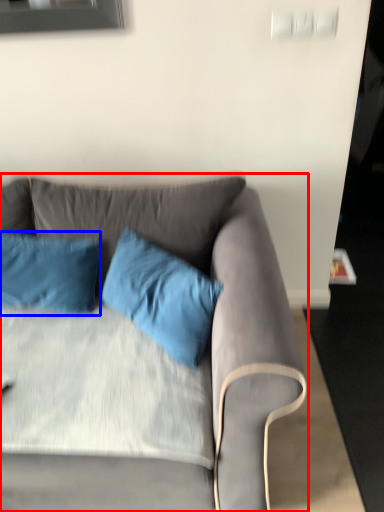
Question: Among these objects, which one is nearest to the camera, studio couch (highlighted by a red box) or pillow (highlighted by a blue box)?

Choices:
 (A) studio couch
 (B) pillow

Answer: (A)